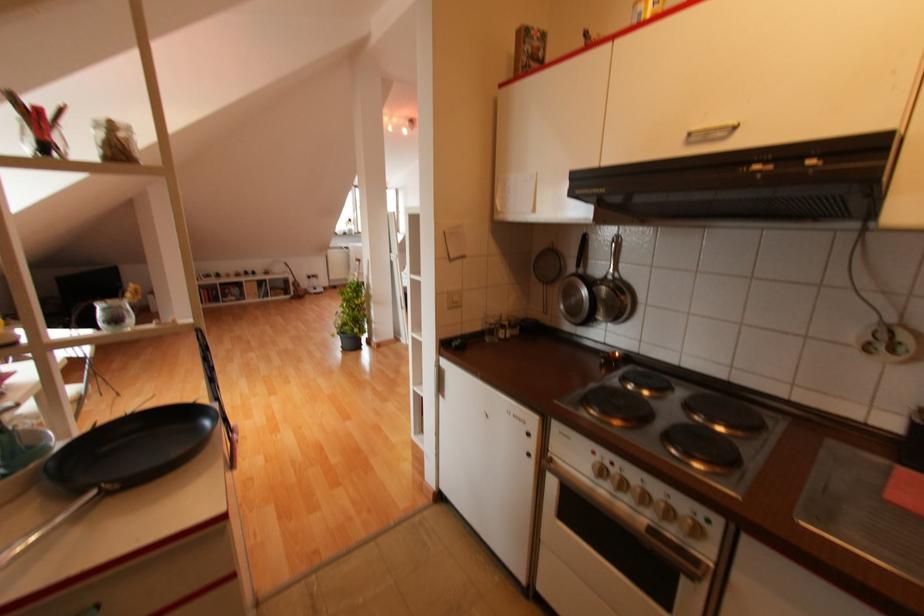
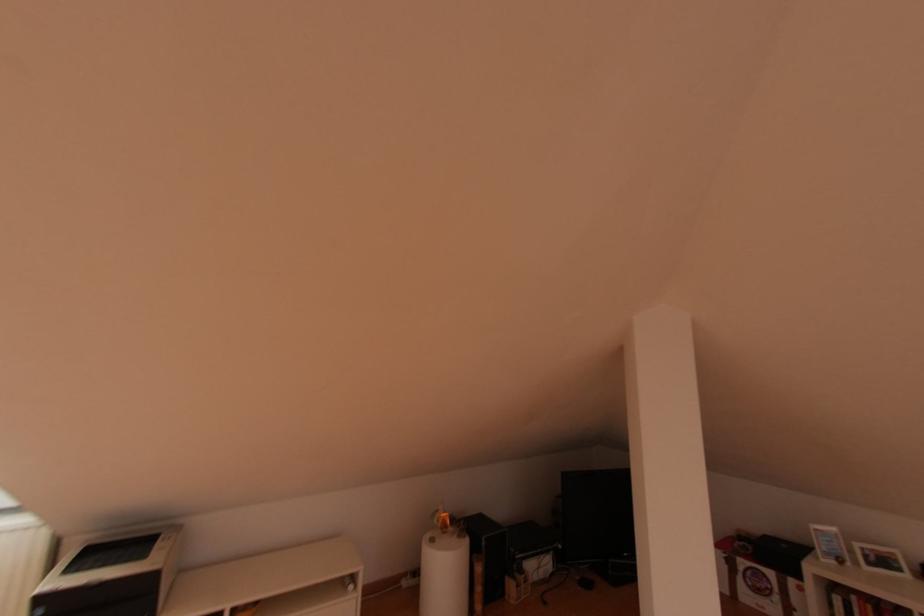
The point at (204, 278) is marked in the first image. Where is the corresponding point in the second image?

(869, 564)